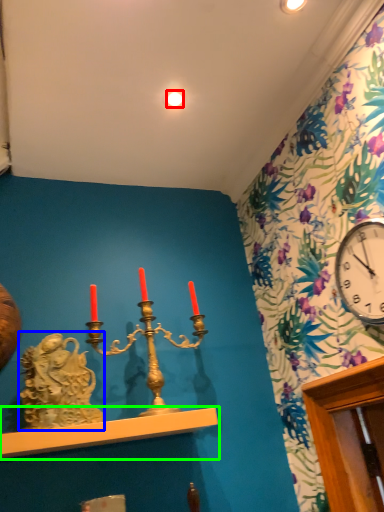
Question: Which is farther away from light (highlighted by a red box)? sculpture (highlighted by a blue box) or shelf (highlighted by a green box)?

Choices:
 (A) sculpture
 (B) shelf

Answer: (B)